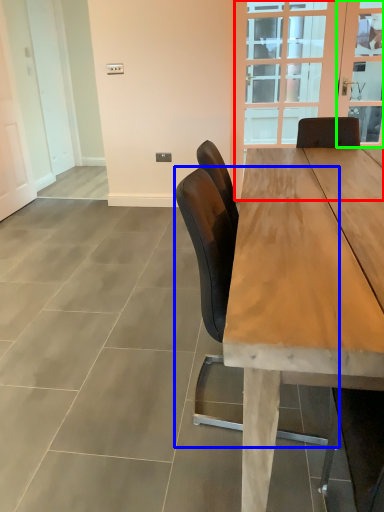
Question: Which is farther away from glass door (highlighted by a red box)? chair (highlighted by a blue box) or window screen (highlighted by a green box)?

Choices:
 (A) chair
 (B) window screen

Answer: (A)